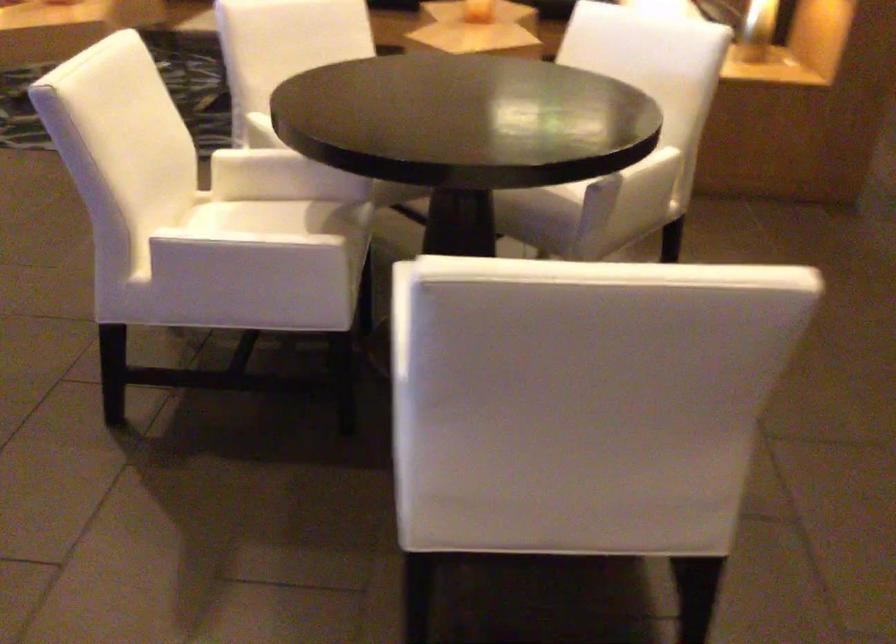
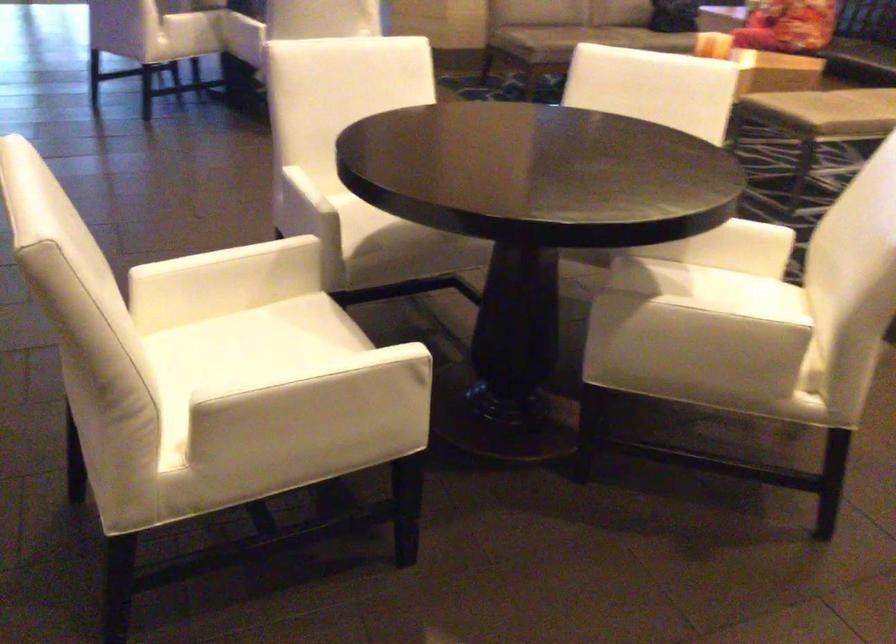
Find the pixel in the second image that matches point (638, 172) in the first image.

(699, 319)